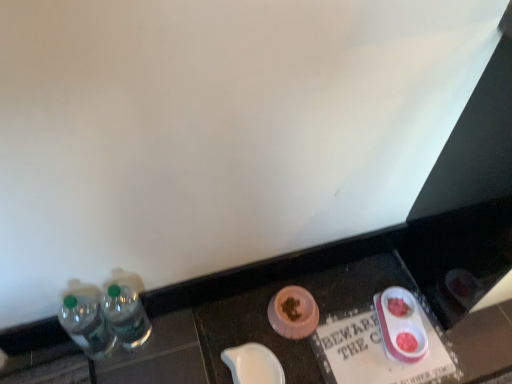
Locate an element on the screen. The height and width of the screenshot is (384, 512). free spot above white paper sign at lower center (from a real-world perspective) is located at coordinates (381, 341).